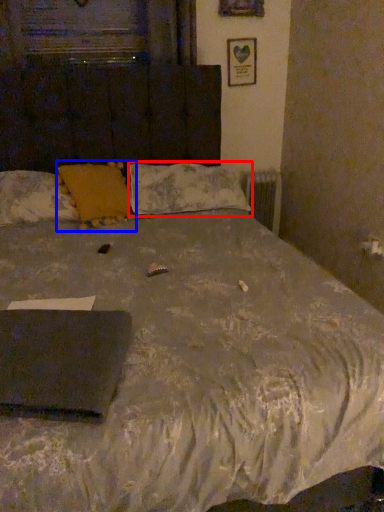
Question: Which object is further to the camera taking this photo, pillow (highlighted by a red box) or pillow (highlighted by a blue box)?

Choices:
 (A) pillow
 (B) pillow

Answer: (A)